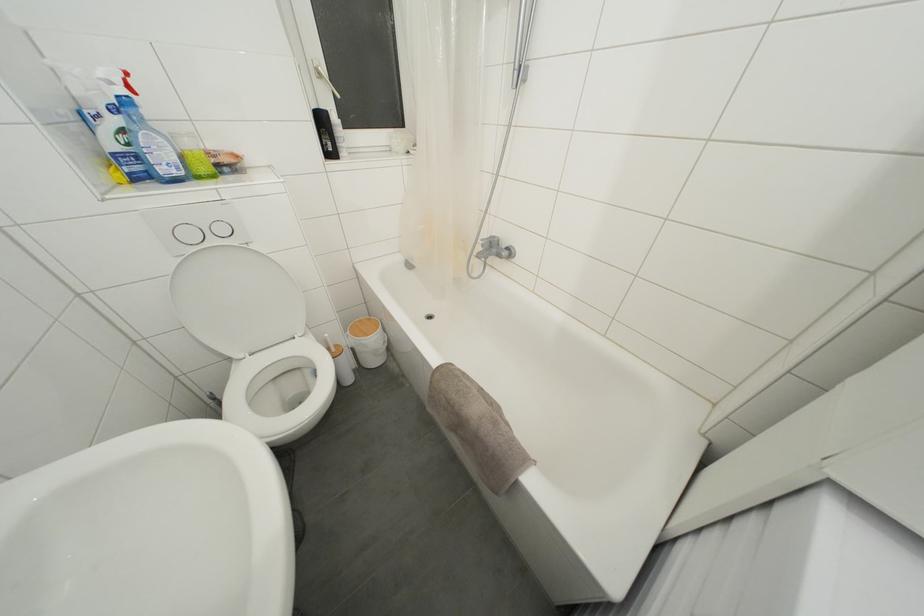
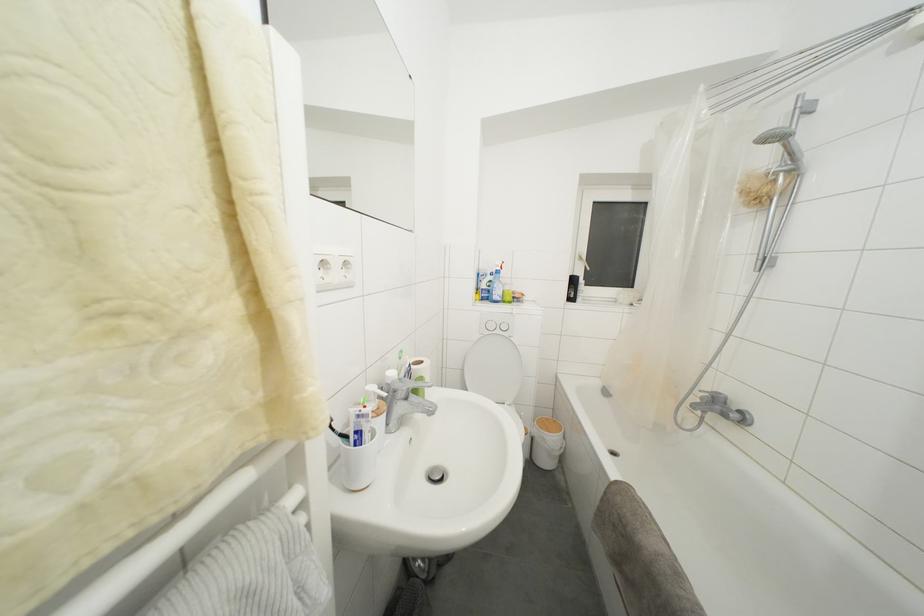
The point at (361,354) is marked in the first image. Where is the corresponding point in the second image?

(541, 445)